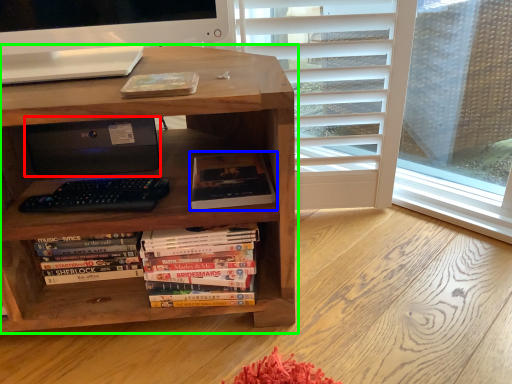
Question: Which is farther away from printer (highlighted by a red box)? book (highlighted by a blue box) or bookcase (highlighted by a green box)?

Choices:
 (A) book
 (B) bookcase

Answer: (A)